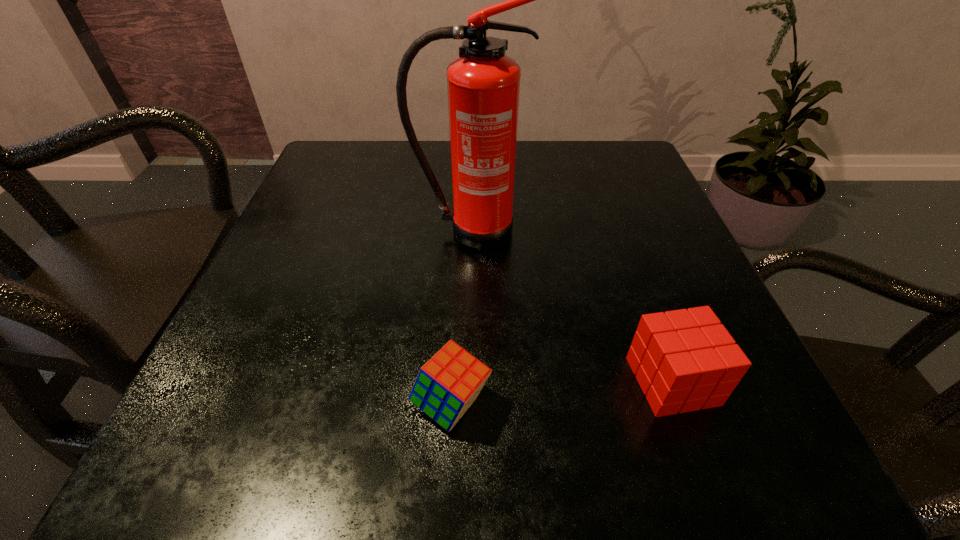
In order to click on vacant space that satisfies the following two spatial constraints: 1. at the nozzle of the fire extinguisher; 2. on the right side of the rightmost object in this screenshot , I will do `click(464, 381)`.